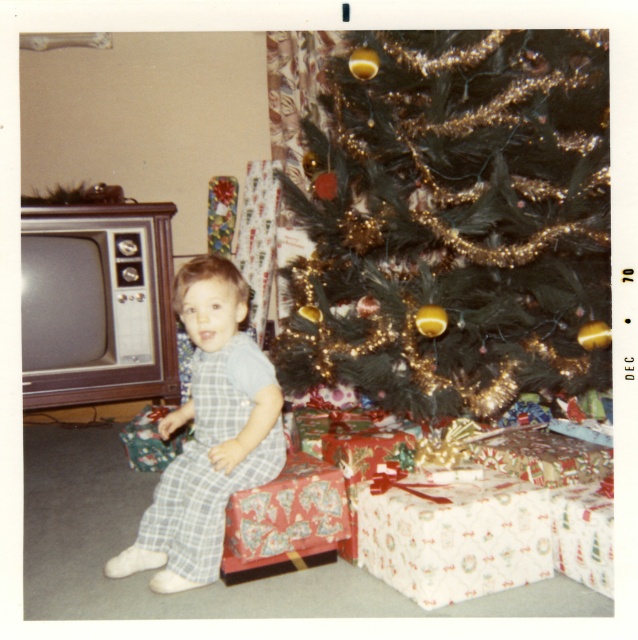
Question: Does green textured christmas tree at center appear over plaid pajamas at center?

Choices:
 (A) yes
 (B) no

Answer: (A)

Question: Can you confirm if green textured christmas tree at center is positioned to the right of plaid pajamas at center?

Choices:
 (A) yes
 (B) no

Answer: (A)

Question: Which point is farther from the camera taking this photo?

Choices:
 (A) (241, 476)
 (B) (581, 380)

Answer: (B)

Question: Which point is farther to the camera?

Choices:
 (A) (463, 45)
 (B) (223, 257)

Answer: (B)

Question: Is green textured christmas tree at center thinner than plaid pajamas at center?

Choices:
 (A) no
 (B) yes

Answer: (A)

Question: Which object is closer to the camera taking this photo?

Choices:
 (A) green textured christmas tree at center
 (B) plaid pajamas at center

Answer: (B)